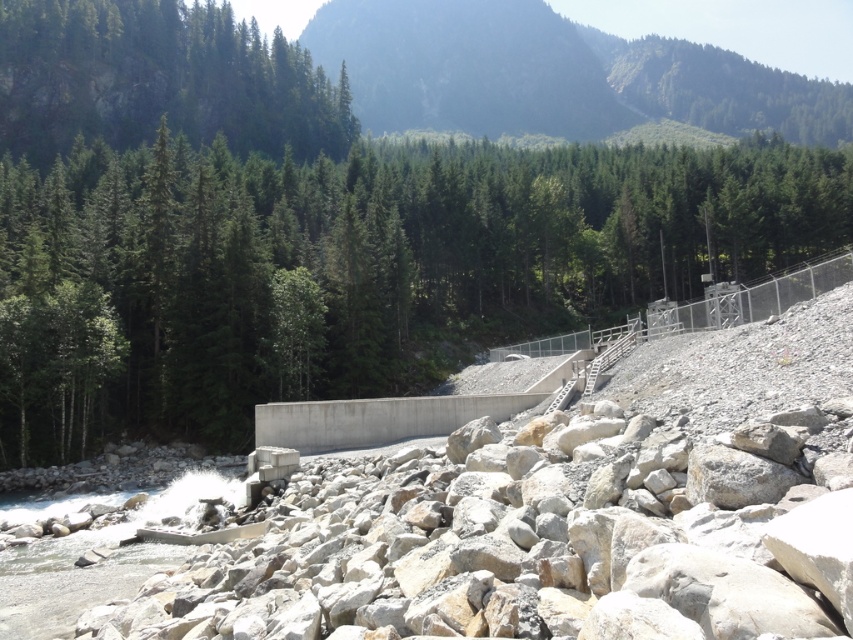
You are a hiker standing at the base of the green forested mountain at upper center. You want to reach the top of the mountain. If your average walking speed is 3 km per hour, how long would it approximately take you to reach the top?

The distance between the green forested mountain at upper center and the camera is 252.76 meters. Assuming the path is direct and the terrain is manageable, it would take approximately 3 minutes to reach the top at a walking speed of 3 km per hour.

You are a hiker trying to navigate through the rocky riverbed and need to reach the green matte tree at upper center. From your current position near the large pile of rocks, which direction should you head relative to the green matte tree at upper left?

You should head towards the direction of the green matte tree at upper left, as the green matte tree at upper center is positioned under it. This means the green matte tree at upper center is located below the green matte tree at upper left, so moving towards the lower area relative to the green matte tree at upper left would lead you there.

You are a drone operator trying to capture a photo of the green matte tree at upper center. The drone has a camera with a 1200mm focal length lens. Given the tree is located at coordinates 0.420, 0.415 in the image, what is the best way to position the drone to ensure the tree is centered in the photo?

The green matte tree at upper center is located at coordinates [352,268]. To center it in the photo, the drone should position itself directly above the tree at those coordinates, ensuring the camera is aligned to frame the tree precisely in the center.